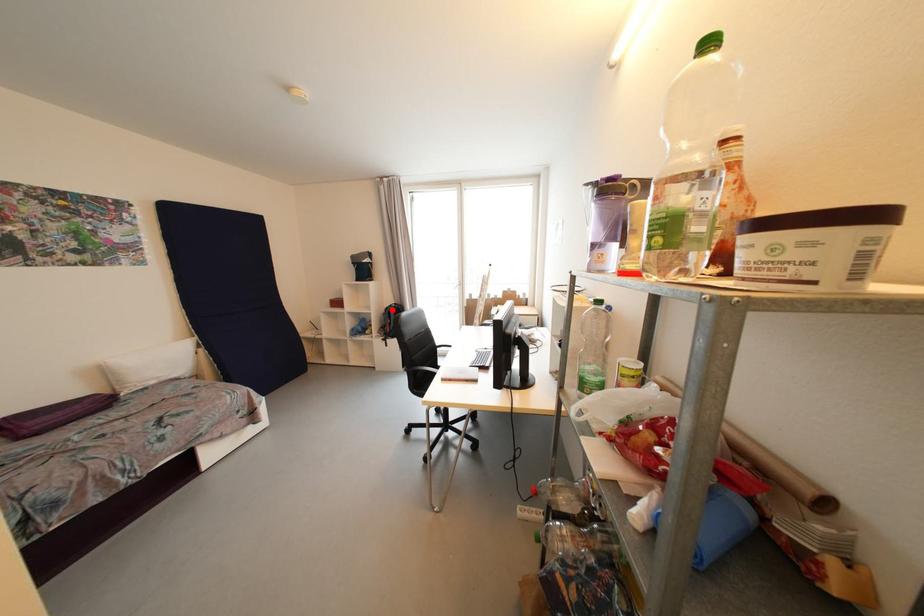
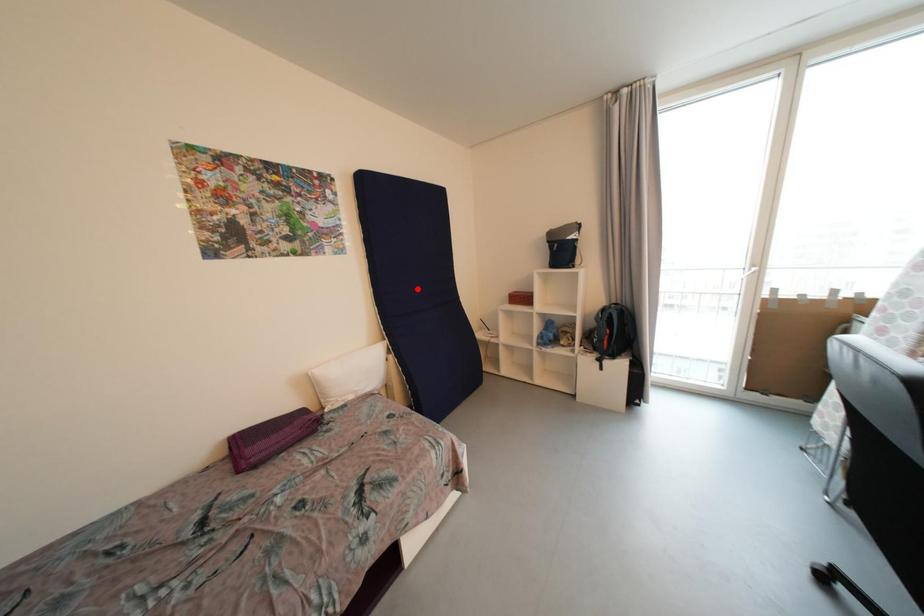
I am providing you with two images of the same scene from different viewpoints. A red point is marked on the first image and another point is marked on the second image. Do the highlighted points in image1 and image2 indicate the same real-world spot?

No